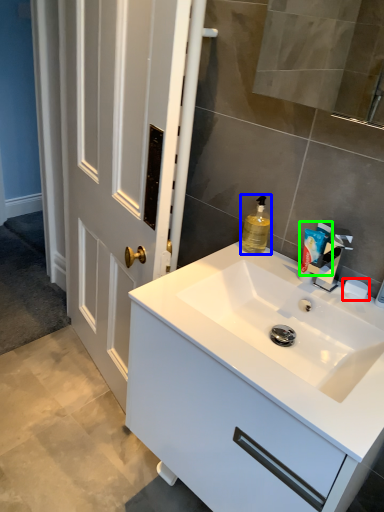
Question: Based on their relative distances, which object is nearer to soap (highlighted by a red box)? Choose from cleaning product (highlighted by a blue box) and toiletry (highlighted by a green box).

Choices:
 (A) cleaning product
 (B) toiletry

Answer: (B)